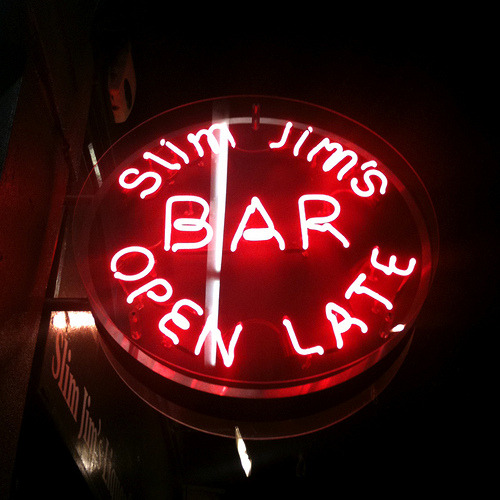
Find the location of a particular element. sign on wall is located at coordinates (57, 397).